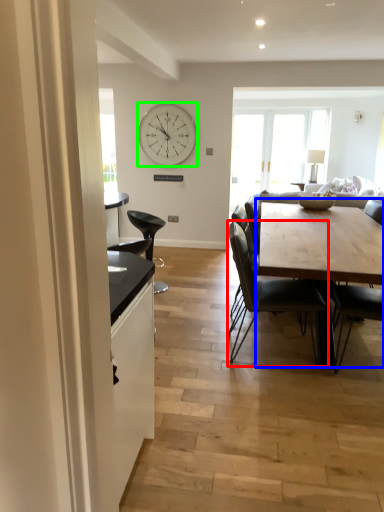
Question: Which object is positioned closest to chair (highlighted by a red box)? Select from table (highlighted by a blue box) and clock (highlighted by a green box).

Choices:
 (A) table
 (B) clock

Answer: (A)